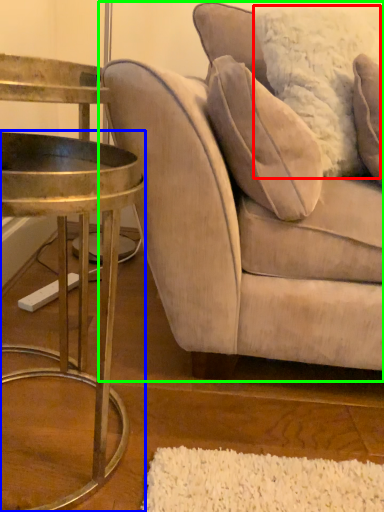
Question: Which object is the closest to the pillow (highlighted by a red box)? Choose among these: table (highlighted by a blue box) or studio couch (highlighted by a green box).

Choices:
 (A) table
 (B) studio couch

Answer: (B)